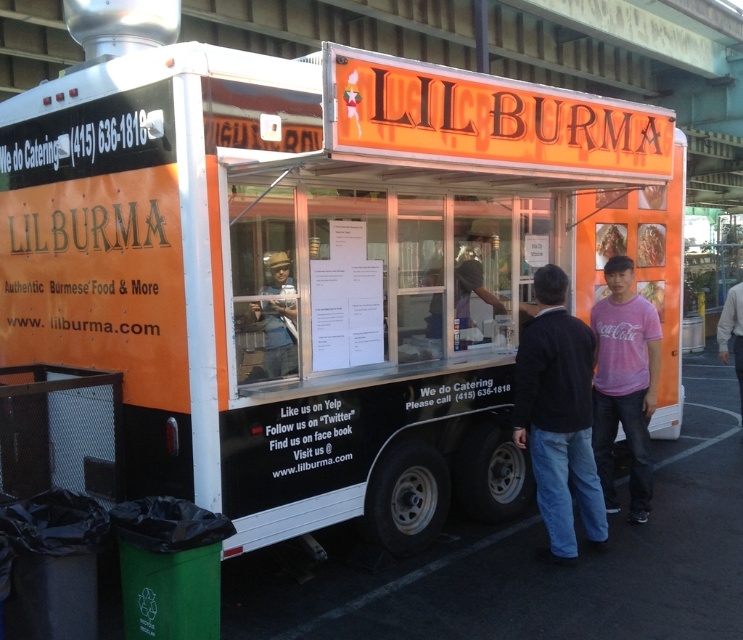
Question: Which object appears closest to the camera in this image?

Choices:
 (A) pink cotton shirt at right
 (B) pink cotton t-shirt at center
 (C) pink cotton t-shirt at center-right

Answer: (B)

Question: Can you confirm if pink cotton t-shirt at center-right is positioned to the right of pink cotton shirt at right?

Choices:
 (A) no
 (B) yes

Answer: (A)

Question: Which object appears farthest from the camera in this image?

Choices:
 (A) pink cotton t-shirt at center-right
 (B) pink cotton t-shirt at center

Answer: (A)

Question: Is pink cotton t-shirt at center-right below pink cotton shirt at right?

Choices:
 (A) no
 (B) yes

Answer: (B)

Question: Which point is closer to the camera?

Choices:
 (A) pink cotton shirt at right
 (B) pink cotton t-shirt at center-right

Answer: (B)

Question: Is pink cotton t-shirt at center further to the viewer compared to pink cotton shirt at right?

Choices:
 (A) no
 (B) yes

Answer: (A)